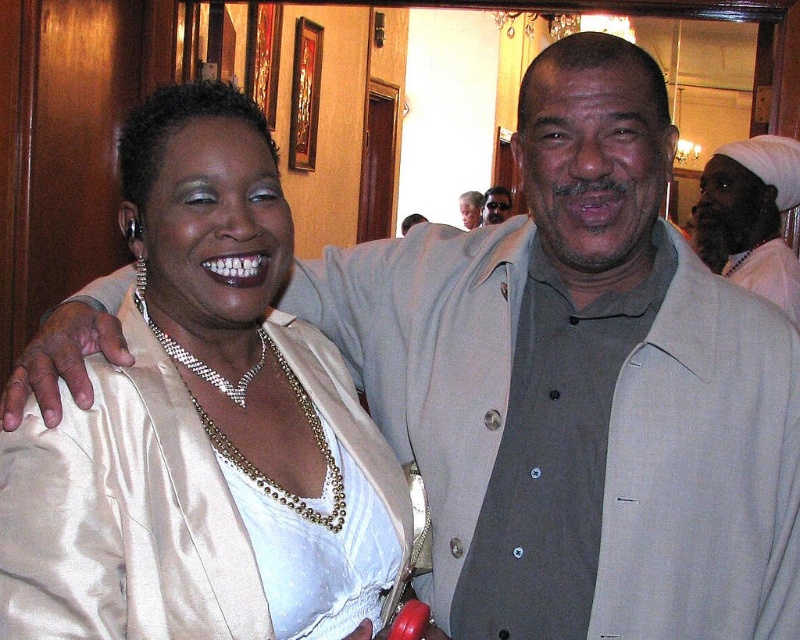
Is white satin turban at upper right positioned before beige satin jacket at upper center?

Yes, white satin turban at upper right is closer to the viewer.

Which is behind, point (774, 230) or point (402, 221)?

The point (402, 221) is behind.

I want to click on white satin turban at upper right, so click(x=750, y=216).

Can you confirm if satin white blouse at center is positioned to the right of matte beige suit at upper center?

Incorrect, satin white blouse at center is not on the right side of matte beige suit at upper center.

Can you confirm if satin white blouse at center is positioned to the left of matte beige suit at upper center?

Correct, you'll find satin white blouse at center to the left of matte beige suit at upper center.

This screenshot has height=640, width=800. What do you see at coordinates (204, 422) in the screenshot?
I see `satin white blouse at center` at bounding box center [204, 422].

Find the location of `satin white blouse at center`. satin white blouse at center is located at coordinates (204, 422).

Which is more to the left, satin white blouse at center or matte gray suit at upper center?

Positioned to the left is satin white blouse at center.

At what (x,y) coordinates should I click in order to perform the action: click on satin white blouse at center. Please return your answer as a coordinate pair (x, y). Looking at the image, I should click on (204, 422).

Which is behind, point (310, 620) or point (484, 202)?

The point (484, 202) is behind.

Locate an element on the screen. satin white blouse at center is located at coordinates (204, 422).